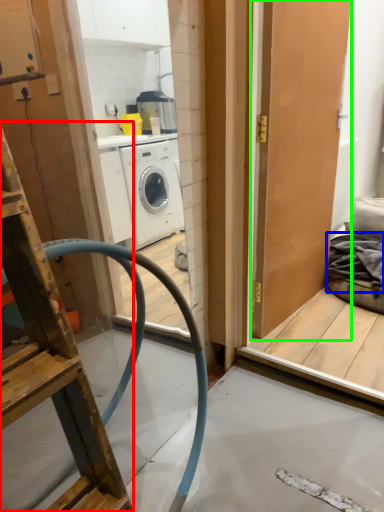
Question: Which object is the closest to the ladder (highlighted by a red box)? Choose among these: material (highlighted by a blue box) or door (highlighted by a green box).

Choices:
 (A) material
 (B) door

Answer: (B)